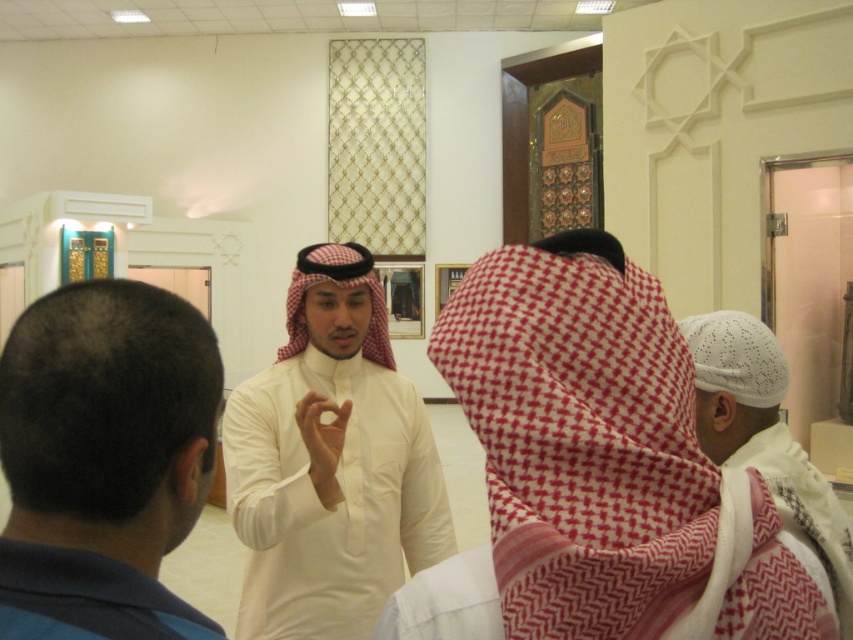
Where is `white cotton kufi at center`? The image size is (853, 640). white cotton kufi at center is located at coordinates (596, 470).

Does white cotton kufi at center appear on the left side of white matte shirt at center?

In fact, white cotton kufi at center is to the right of white matte shirt at center.

Is point (683, 483) positioned behind point (310, 616)?

No.

Identify the location of white cotton kufi at center. (596, 470).

Which of these two, dark blue hair at back or blue fabric robe at lower left, stands shorter?

With less height is blue fabric robe at lower left.

Is dark blue hair at back taller than blue fabric robe at lower left?

Correct, dark blue hair at back is much taller as blue fabric robe at lower left.

Does point (138, 556) lie in front of point (18, 545)?

No.

At what (x,y) coordinates should I click in order to perform the action: click on dark blue hair at back. Please return your answer as a coordinate pair (x, y). The height and width of the screenshot is (640, 853). Looking at the image, I should click on (105, 449).

Is point (47, 320) positioned after point (833, 547)?

No, (47, 320) is in front of (833, 547).

Does dark blue hair at back have a greater height compared to white knitted cap at center?

Incorrect, dark blue hair at back's height is not larger of white knitted cap at center's.

Between point (20, 500) and point (809, 492), which one is positioned behind?

The point (809, 492) is more distant.

Where is `dark blue hair at back`? The height and width of the screenshot is (640, 853). dark blue hair at back is located at coordinates (105, 449).